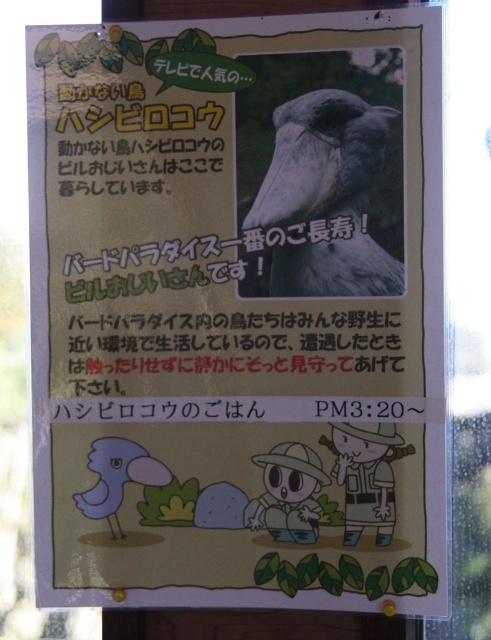
You are a zoo visitor looking at the poster. Where is the gray matte bird at center located on the poster?

The gray matte bird at center is located at point coordinates of (322, 200).

You are a zookeeper who needs to place two birds in separate cages. The gray matte bird at center and the matte blue bird at lower left are both in the same enclosure. Which bird requires a wider cage based on their size?

The gray matte bird at center requires a wider cage because it might be wider than the matte blue bird at lower left.

You are standing in front of the zoo signboard about the Hawk Eagle. There are two points marked on the signboard. The first point is at coordinate point (290, 196) and the second is at point (108, 465). If you were to draw a straight line between these two points, which point would be closer to you?

Point (290, 196) is in front of point (108, 465), so the first point would be closer to you.